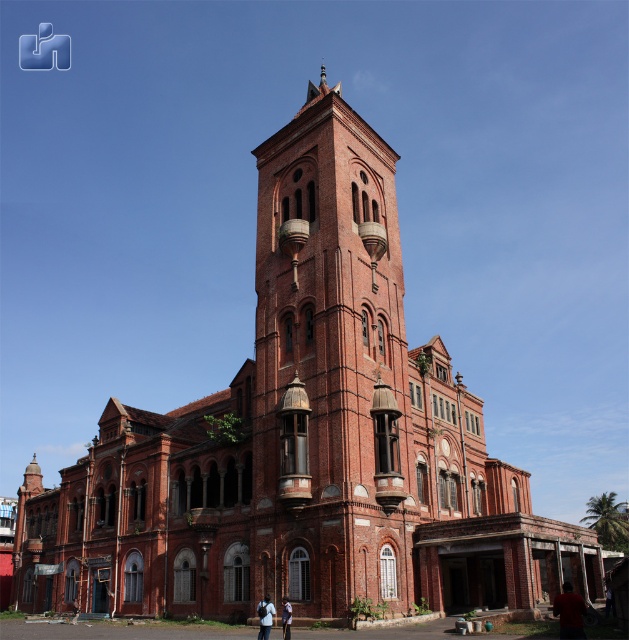
Does matte red shirt at lower right appear on the right side of light blue uniform at center?

Correct, you'll find matte red shirt at lower right to the right of light blue uniform at center.

The image size is (629, 640). What do you see at coordinates (569, 612) in the screenshot?
I see `matte red shirt at lower right` at bounding box center [569, 612].

Identify the location of matte red shirt at lower right. The height and width of the screenshot is (640, 629). (569, 612).

Can you confirm if dark blue fabric at lower center is positioned below light blue uniform at center?

Indeed, dark blue fabric at lower center is positioned under light blue uniform at center.

Does dark blue fabric at lower center have a lesser width compared to light blue uniform at center?

No, dark blue fabric at lower center is not thinner than light blue uniform at center.

I want to click on dark blue fabric at lower center, so click(x=264, y=616).

Does point (338, 397) come farther from viewer compared to point (281, 616)?

Yes.

Locate an element on the screen. This screenshot has height=640, width=629. red brick bell tower at center is located at coordinates [330, 368].